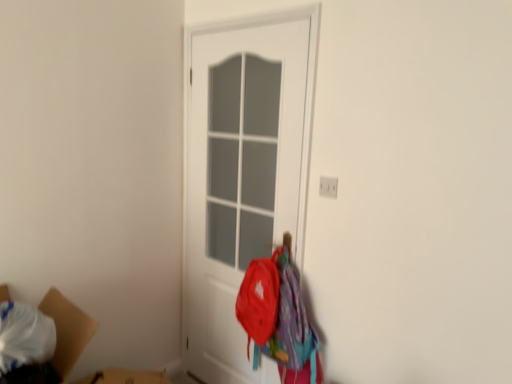
Question: Can we say white matte door at center lies outside white plastic electric outlet at upper right?

Choices:
 (A) no
 (B) yes

Answer: (B)

Question: Is white matte door at center taller than white plastic electric outlet at upper right?

Choices:
 (A) yes
 (B) no

Answer: (A)

Question: Is white matte door at center next to white plastic electric outlet at upper right and touching it?

Choices:
 (A) no
 (B) yes

Answer: (A)

Question: From a real-world perspective, is white matte door at center located beneath white plastic electric outlet at upper right?

Choices:
 (A) no
 (B) yes

Answer: (B)

Question: Can you confirm if white matte door at center is wider than white plastic electric outlet at upper right?

Choices:
 (A) yes
 (B) no

Answer: (A)

Question: Could you tell me if white matte door at center is turned towards white plastic electric outlet at upper right?

Choices:
 (A) no
 (B) yes

Answer: (A)

Question: Can you confirm if white matte door at center is smaller than cardboard box at lower left?

Choices:
 (A) yes
 (B) no

Answer: (A)

Question: Is white matte door at center thinner than cardboard box at lower left?

Choices:
 (A) no
 (B) yes

Answer: (B)

Question: Could you tell me if white matte door at center is facing cardboard box at lower left?

Choices:
 (A) yes
 (B) no

Answer: (A)

Question: Does white matte door at center have a larger size compared to cardboard box at lower left?

Choices:
 (A) yes
 (B) no

Answer: (B)

Question: Is white matte door at center positioned beyond the bounds of cardboard box at lower left?

Choices:
 (A) yes
 (B) no

Answer: (A)

Question: From a real-world perspective, is white matte door at center over cardboard box at lower left?

Choices:
 (A) no
 (B) yes

Answer: (B)

Question: Is white matte door at center oriented away from matte red backpack at lower right?

Choices:
 (A) yes
 (B) no

Answer: (A)